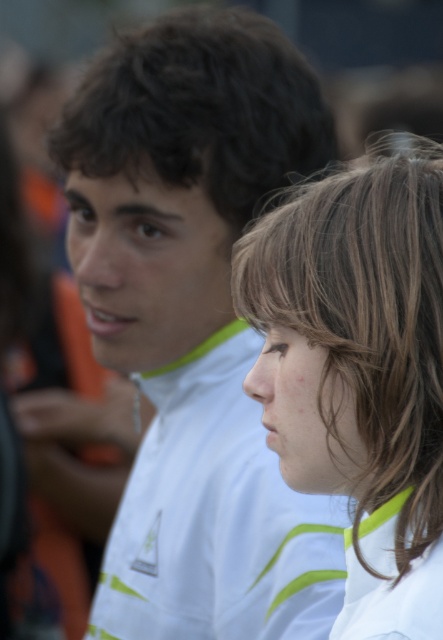
What is the exact coordinate of the white matte jacket at center?

The white matte jacket at center is located at point (x=195, y=323).

You are at an outdoor event and see the white matte jacket at center. If you want to locate it on a coordinate grid where the bottom left corner is 0,0 and the top right corner is 1,1, what are its coordinates?

The white matte jacket at center is located at coordinates point (x=195, y=323).